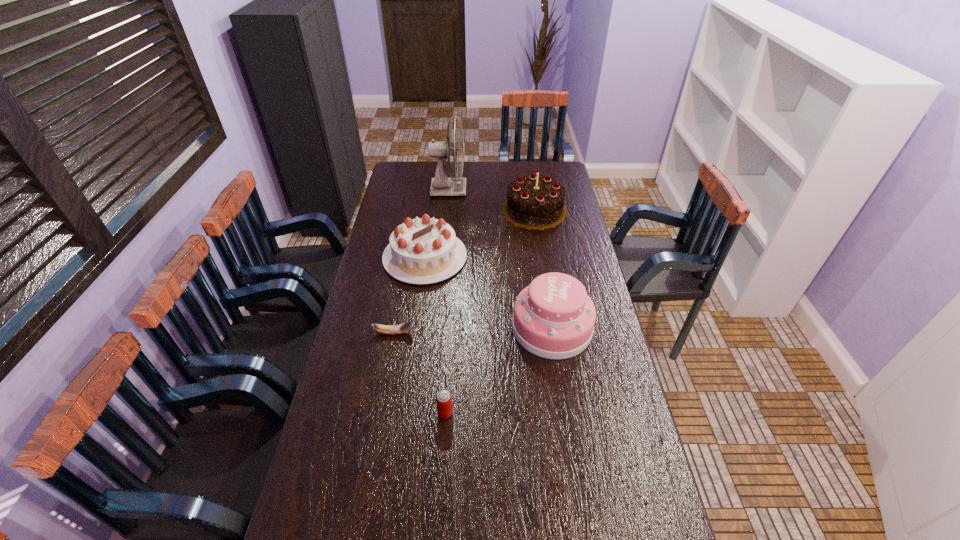
You are a GUI agent. You are given a task and a screenshot of the screen. Output one action in this format:
    pyautogui.click(x=<x>, y=<y>)
    Task: Click on the tallest object
    
    Given the screenshot: What is the action you would take?
    pyautogui.click(x=441, y=185)

This screenshot has height=540, width=960. What are the coordinates of `the farthest birthday cake` in the screenshot? It's located at (533, 202).

Find the location of `the nearest birthday cake`. the nearest birthday cake is located at coordinates (553, 318).

Find the location of a particular element. This screenshot has height=540, width=960. the second farthest birthday cake is located at coordinates (421, 251).

At what (x,y) coordinates should I click in order to perform the action: click on the leftmost birthday cake. Please return your answer as a coordinate pair (x, y). This screenshot has height=540, width=960. Looking at the image, I should click on (421, 251).

Where is `beer can`? beer can is located at coordinates (443, 399).

At what (x,y) coordinates should I click in order to perform the action: click on banana. Please return your answer as a coordinate pair (x, y). Looking at the image, I should click on (405, 327).

At what (x,y) coordinates should I click in order to perform the action: click on vacant space situated 0.340m on the front-facing side of the tallest object. Please return your answer as a coordinate pair (x, y). Looking at the image, I should click on (534, 190).

Find the location of a particular element. Image resolution: width=960 pixels, height=540 pixels. free region located 0.230m on the back of the farthest birthday cake is located at coordinates (528, 169).

At what (x,y) coordinates should I click in order to perform the action: click on vacant space located on the front of the nearest birthday cake. Please return your answer as a coordinate pair (x, y). The width and height of the screenshot is (960, 540). Looking at the image, I should click on (566, 422).